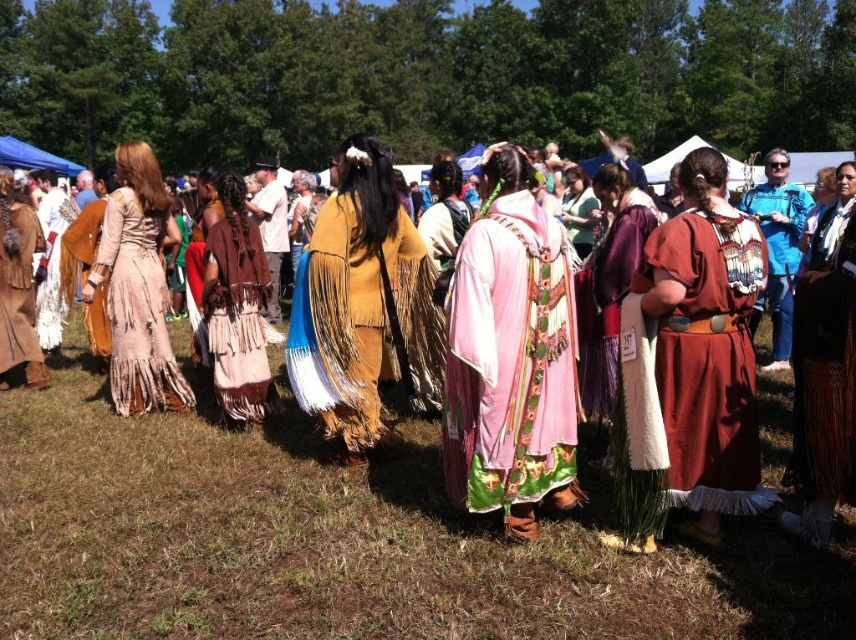
How much distance is there between maroon suede skirt at center and brown suede skirt at center?

They are 2.36 meters apart.

At what (x,y) coordinates should I click in order to perform the action: click on maroon suede skirt at center. Please return your answer as a coordinate pair (x, y). The image size is (856, 640). Looking at the image, I should click on (626, 368).

Identify the location of maroon suede skirt at center. (626, 368).

Does brown suede skirt at center appear under blue denim jacket at upper right?

Indeed, brown suede skirt at center is positioned under blue denim jacket at upper right.

What do you see at coordinates (236, 308) in the screenshot?
I see `brown suede skirt at center` at bounding box center [236, 308].

The image size is (856, 640). Identify the location of brown suede skirt at center. (236, 308).

Based on the photo, which is above, brown woven skirt at right or matte brown dress at left?

matte brown dress at left is higher up.

Is brown woven skirt at right shorter than matte brown dress at left?

No, brown woven skirt at right is not shorter than matte brown dress at left.

The image size is (856, 640). What do you see at coordinates (825, 372) in the screenshot? I see `brown woven skirt at right` at bounding box center [825, 372].

At what (x,y) coordinates should I click in order to perform the action: click on brown woven skirt at right. Please return your answer as a coordinate pair (x, y). The width and height of the screenshot is (856, 640). Looking at the image, I should click on (825, 372).